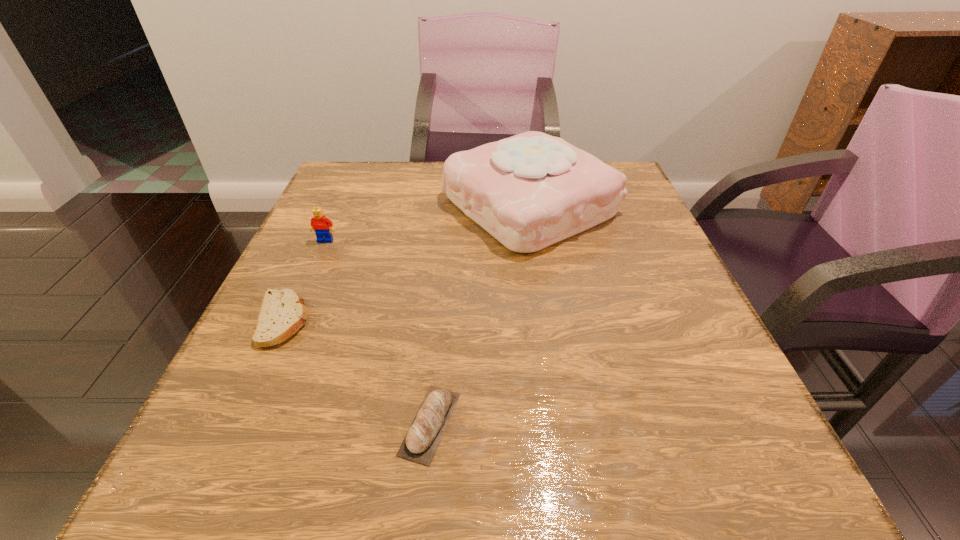
Where is `object that is positioned at the far edge`? object that is positioned at the far edge is located at coordinates (529, 191).

Where is `object present at the near edge`? This screenshot has width=960, height=540. object present at the near edge is located at coordinates (427, 428).

Image resolution: width=960 pixels, height=540 pixels. I want to click on Lego located in the left edge section of the desktop, so click(319, 223).

The image size is (960, 540). I want to click on pita bread that is at the left edge, so click(x=282, y=313).

In order to click on object present at the right edge in this screenshot , I will do `click(529, 191)`.

Locate an element on the screen. object that is at the far right corner is located at coordinates (529, 191).

This screenshot has width=960, height=540. In the image, there is a desktop. Identify the location of free region at the far edge. (400, 183).

You are a GUI agent. You are given a task and a screenshot of the screen. Output one action in this format:
    pyautogui.click(x=<x>, y=<y>)
    Task: Click on the free space at the near edge
    
    Given the screenshot: What is the action you would take?
    pyautogui.click(x=564, y=458)

Where is `vacant space at the left edge`? The image size is (960, 540). vacant space at the left edge is located at coordinates (318, 287).

Where is `vacant point at the right edge`? The height and width of the screenshot is (540, 960). vacant point at the right edge is located at coordinates (691, 296).